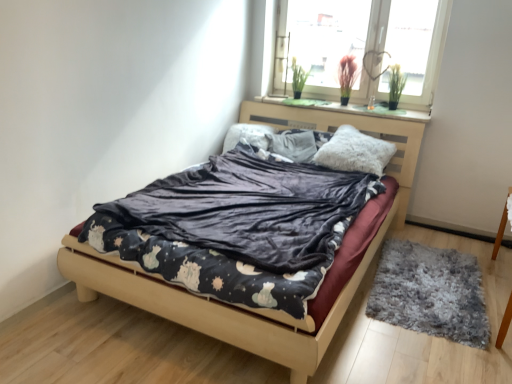
Identify the location of vacant space underneath gray shaggy rug at lower right (from a real-world perspective). (425, 283).